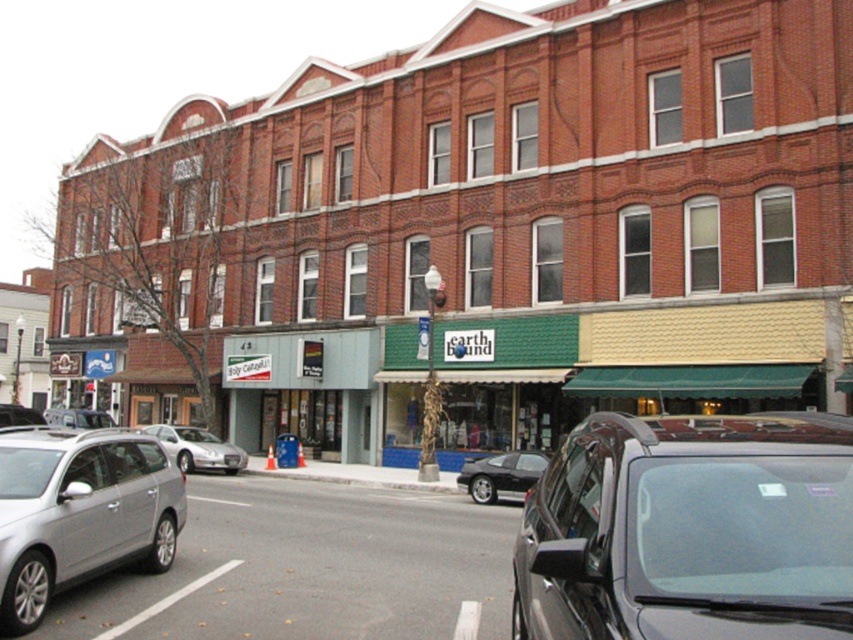
You are a pedestrian standing on the sidewalk in front of the multi story brick building. You see a shiny black car at lower right and a silver metallic car at lower left. Which car is nearer to you?

The shiny black car at lower right is closer to the viewer than the silver metallic car at lower left.

From the picture: You are a pedestrian standing on the sidewalk in front of the multi story brick building. You see a shiny black car at center and a silver metallic sedan at center. Which car is positioned higher relative to the other?

The shiny black car at center is located above the silver metallic sedan at center, so it is positioned higher.